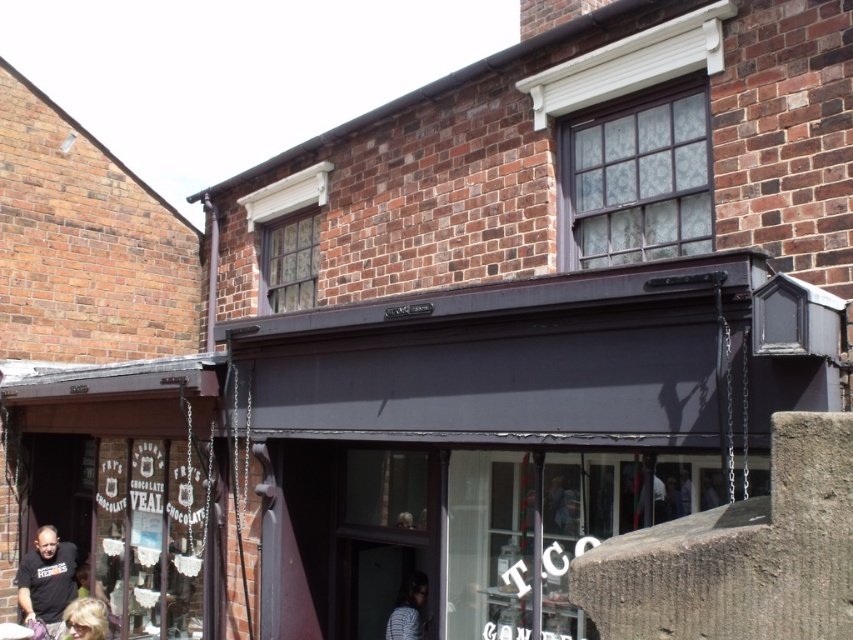
Question: Which point appears farthest from the camera in this image?

Choices:
 (A) (421, 589)
 (B) (67, 548)
 (C) (74, 628)

Answer: (B)

Question: Is dark gray t-shirt at lower left below striped fabric person at lower center?

Choices:
 (A) no
 (B) yes

Answer: (B)

Question: Based on their relative distances, which object is nearer to the dark gray t-shirt at lower left?

Choices:
 (A) blonde hair at lower left
 (B) striped fabric person at lower center

Answer: (A)

Question: Is striped fabric person at lower center above blonde hair at lower left?

Choices:
 (A) yes
 (B) no

Answer: (B)

Question: Is dark gray t-shirt at lower left smaller than blonde hair at lower left?

Choices:
 (A) no
 (B) yes

Answer: (A)

Question: Which of the following is the closest to the observer?

Choices:
 (A) blonde hair at lower left
 (B) dark gray t-shirt at lower left
 (C) striped fabric person at lower center

Answer: (A)